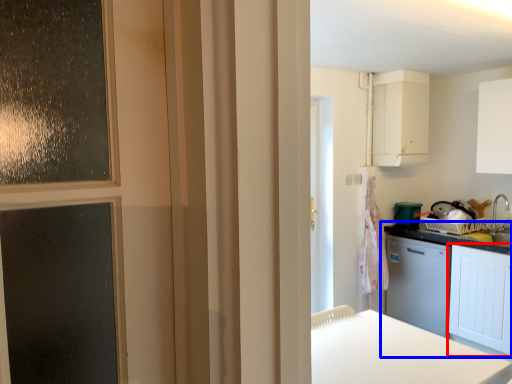
Question: Which point is further to the camera, cabinetry (highlighted by a red box) or cabinetry (highlighted by a blue box)?

Choices:
 (A) cabinetry
 (B) cabinetry

Answer: (B)